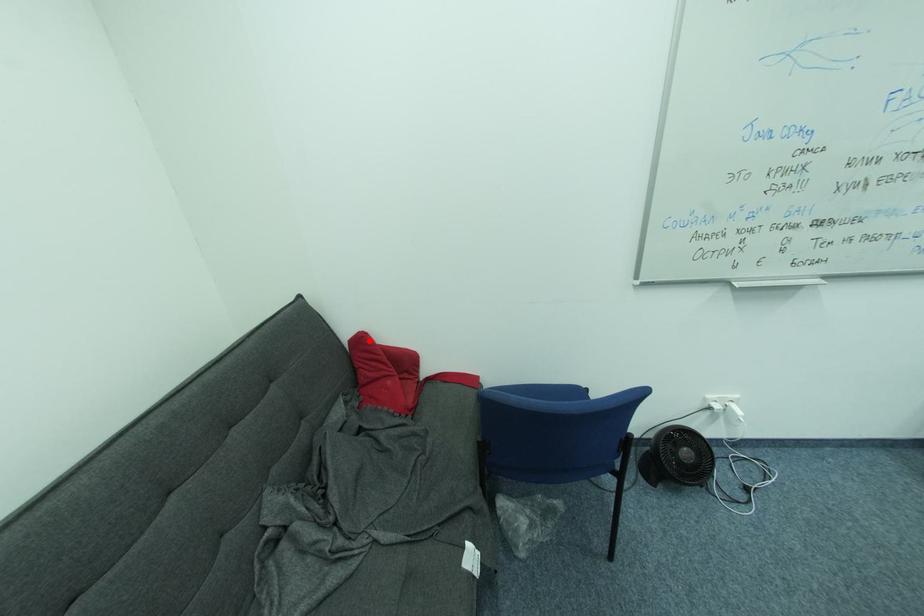
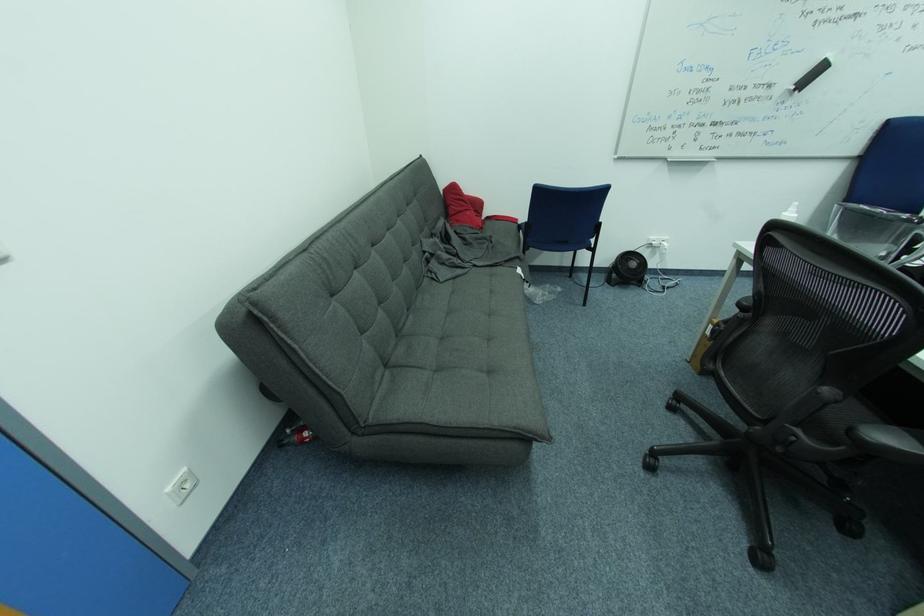
Question: I am providing you with two images of the same scene from different viewpoints. A red point is marked on the first image. Can you still see the location of the red point in image 2?

Choices:
 (A) Yes
 (B) No

Answer: (A)